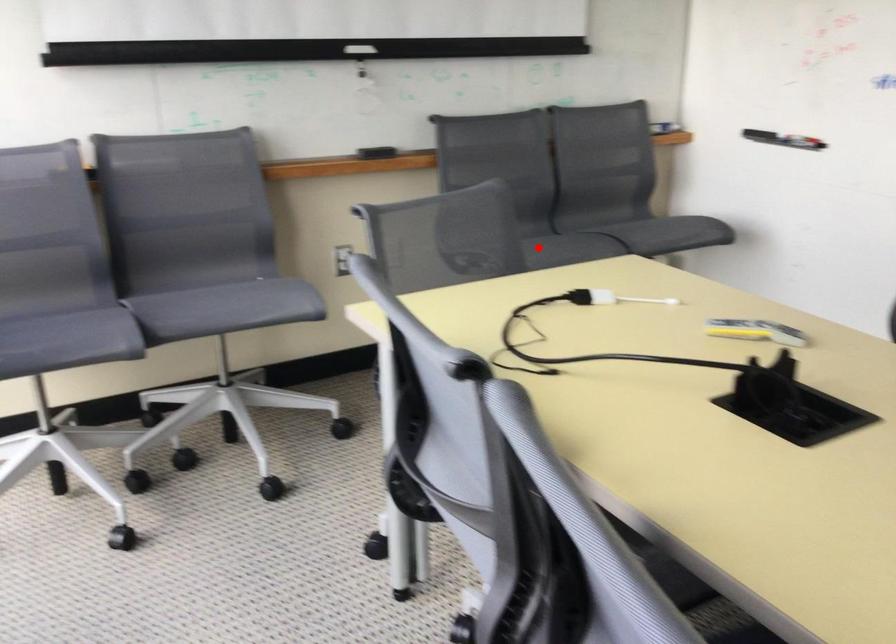
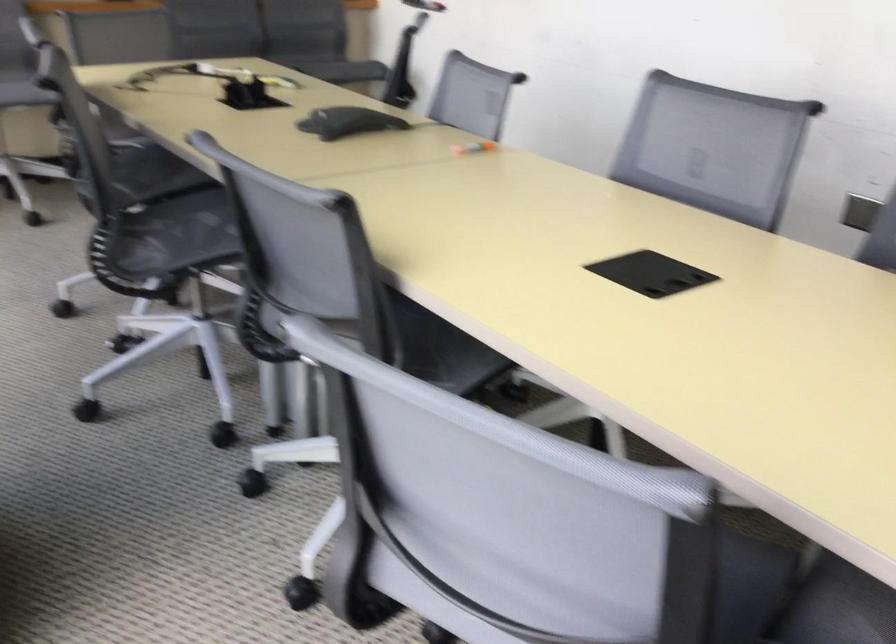
Question: I am providing you with two images of the same scene from different viewpoints. A red point is marked on the first image. Can you still see the location of the red point in image 2?

Choices:
 (A) Yes
 (B) No

Answer: (B)